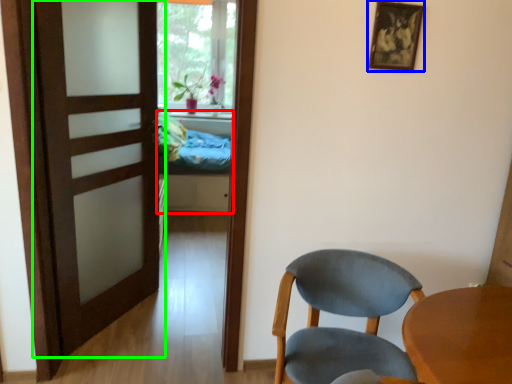
Question: Estimate the real-world distances between objects in this image. Which object is farther from bed (highlighted by a red box), picture frame (highlighted by a blue box) or door (highlighted by a green box)?

Choices:
 (A) picture frame
 (B) door

Answer: (A)